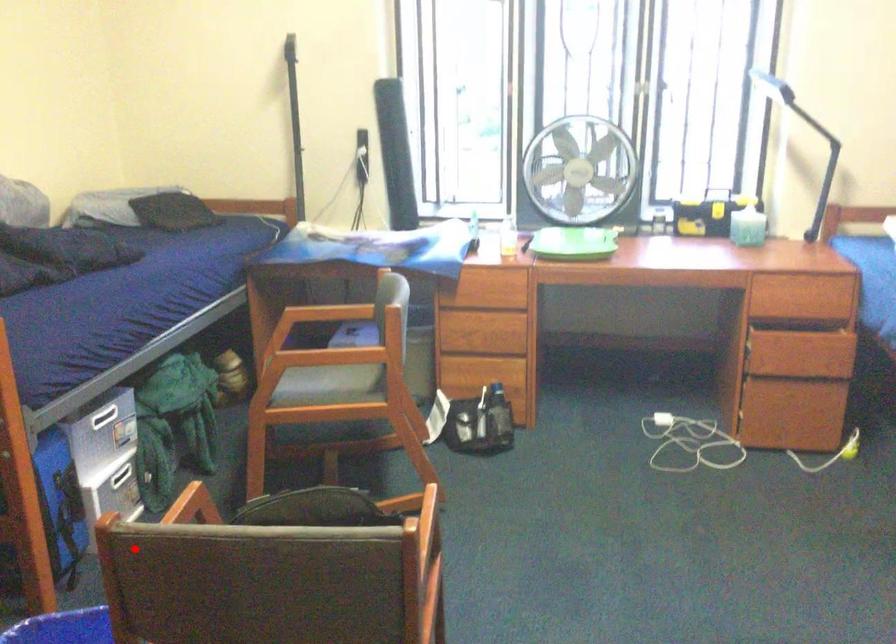
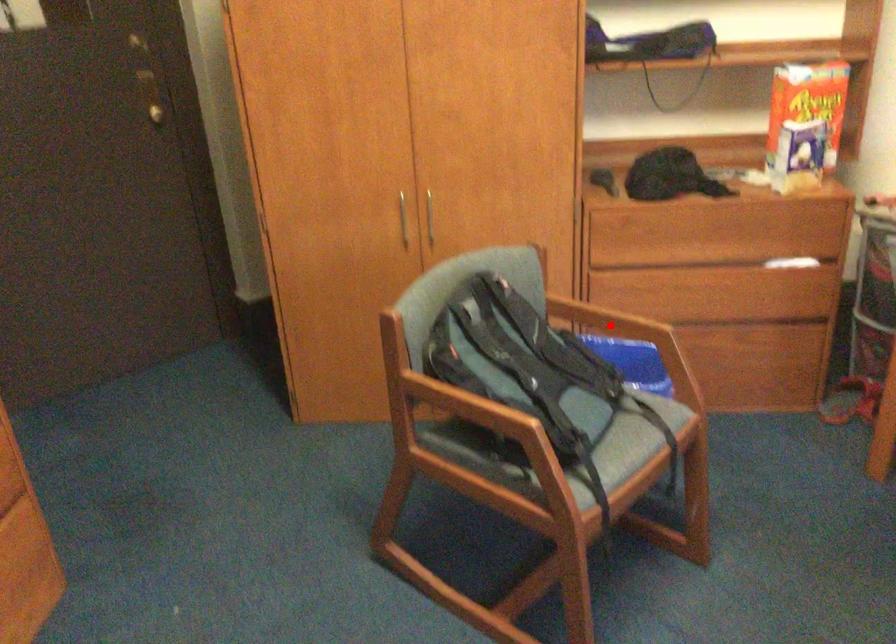
I am providing you with two images of the same scene from different viewpoints. A red point is marked on the first image and another point is marked on the second image. Is the marked point in image1 the same physical position as the marked point in image2?

Yes